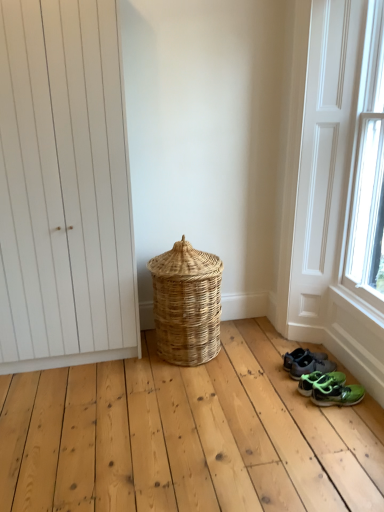
Question: From a real-world perspective, is natural woven basket at center positioned over green matte sneakers at lower right, marked as the third footwear in a back-to-front arrangement, based on gravity?

Choices:
 (A) no
 (B) yes

Answer: (B)

Question: Is natural woven basket at center smaller than green matte sneakers at lower right, marked as the third footwear in a back-to-front arrangement?

Choices:
 (A) no
 (B) yes

Answer: (A)

Question: Is natural woven basket at center oriented towards green matte sneakers at lower right, which appears as the 1th footwear when viewed from the front?

Choices:
 (A) yes
 (B) no

Answer: (B)

Question: Does natural woven basket at center have a greater height compared to green matte sneakers at lower right, which appears as the 1th footwear when viewed from the front?

Choices:
 (A) yes
 (B) no

Answer: (A)

Question: Is natural woven basket at center closer to camera compared to green matte sneakers at lower right, marked as the third footwear in a back-to-front arrangement?

Choices:
 (A) no
 (B) yes

Answer: (A)

Question: Is natural woven basket at center facing away from green matte sneakers at lower right, marked as the third footwear in a back-to-front arrangement?

Choices:
 (A) yes
 (B) no

Answer: (B)

Question: Considering the relative sizes of green matte sneakers at lower right, marked as the third footwear in a back-to-front arrangement, and green rubber sandals at lower right, arranged as the 2th footwear when viewed from the back, in the image provided, is green matte sneakers at lower right, marked as the third footwear in a back-to-front arrangement, wider than green rubber sandals at lower right, arranged as the 2th footwear when viewed from the back,?

Choices:
 (A) no
 (B) yes

Answer: (A)

Question: Is green matte sneakers at lower right, which appears as the 1th footwear when viewed from the front, to the left of green rubber sandals at lower right, arranged as the 2th footwear when viewed from the back, from the viewer's perspective?

Choices:
 (A) no
 (B) yes

Answer: (A)

Question: Are green matte sneakers at lower right, marked as the third footwear in a back-to-front arrangement, and green rubber sandals at lower right, arranged as the 2th footwear when viewed from the back, far apart?

Choices:
 (A) yes
 (B) no

Answer: (B)

Question: Could you tell me if green matte sneakers at lower right, which appears as the 1th footwear when viewed from the front, is facing green rubber sandals at lower right, arranged as the 2th footwear when viewed from the back?

Choices:
 (A) no
 (B) yes

Answer: (A)

Question: From the image's perspective, is green matte sneakers at lower right, which appears as the 1th footwear when viewed from the front, located beneath green rubber sandals at lower right, arranged as the 2th footwear when viewed from the back?

Choices:
 (A) no
 (B) yes

Answer: (B)

Question: Can you confirm if green matte sneakers at lower right, which appears as the 1th footwear when viewed from the front, is shorter than green rubber sandals at lower right, arranged as the 2th footwear when viewed from the back?

Choices:
 (A) no
 (B) yes

Answer: (B)

Question: Is green matte sneakers at lower right, marked as the third footwear in a back-to-front arrangement, aimed at white wood screen door at lower right?

Choices:
 (A) no
 (B) yes

Answer: (B)